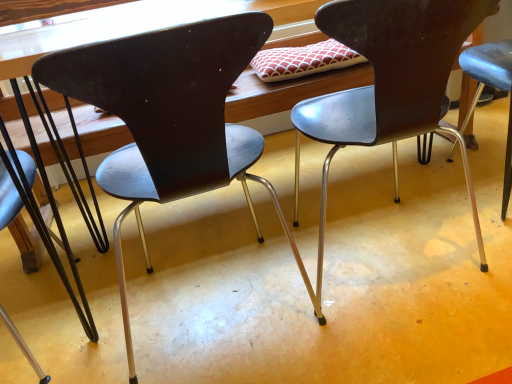
The width and height of the screenshot is (512, 384). Identify the location of vacant space underneath metallic black chair at center, acting as the 1th chair starting from the right (from a real-world perspective). (375, 246).